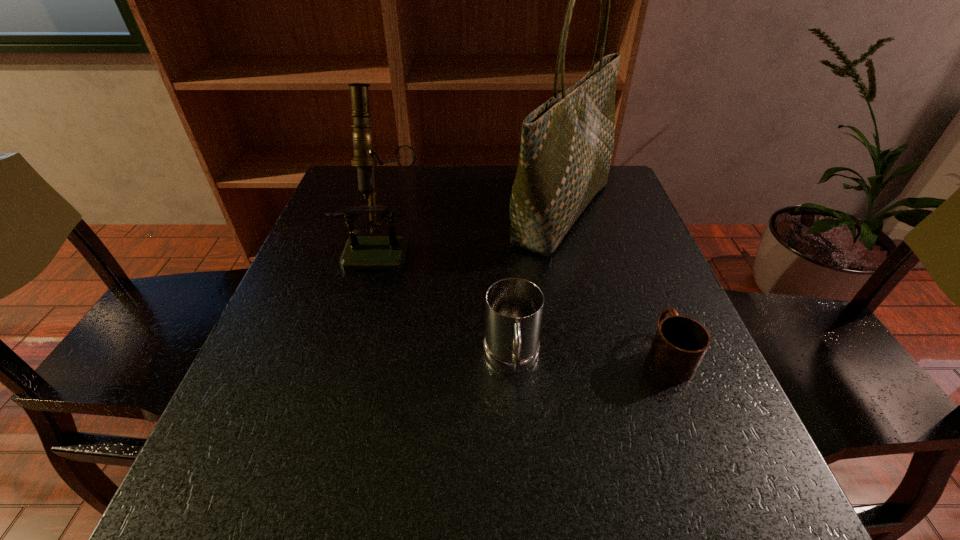
Locate an element on the screen. blank area at the left edge is located at coordinates (317, 453).

You are a GUI agent. You are given a task and a screenshot of the screen. Output one action in this format:
    pyautogui.click(x=<x>, y=<y>)
    Task: Click on the free space at the right edge
    The height and width of the screenshot is (540, 960).
    Given the screenshot: What is the action you would take?
    pyautogui.click(x=642, y=219)

Find the location of a particular element. The image size is (960, 540). free space between the tallest object and the shorter mug is located at coordinates (614, 282).

The width and height of the screenshot is (960, 540). I want to click on vacant area that lies between the leftmost object and the tallest object, so click(x=473, y=228).

This screenshot has height=540, width=960. In order to click on unoccupied area between the leftmost object and the shopping bag in this screenshot , I will do [x=473, y=228].

You are a GUI agent. You are given a task and a screenshot of the screen. Output one action in this format:
    pyautogui.click(x=<x>, y=<y>)
    Task: Click on the vacant space that is in between the shopping bag and the leftmost object
    
    Given the screenshot: What is the action you would take?
    pyautogui.click(x=473, y=228)

Find the location of `unoccupied area between the shopping bag and the shorter mug`. unoccupied area between the shopping bag and the shorter mug is located at coordinates (614, 282).

Where is `object that is the closest to the leftmost object`? This screenshot has width=960, height=540. object that is the closest to the leftmost object is located at coordinates (567, 143).

Image resolution: width=960 pixels, height=540 pixels. In order to click on the closest object to the leftmost object in this screenshot , I will do `click(567, 143)`.